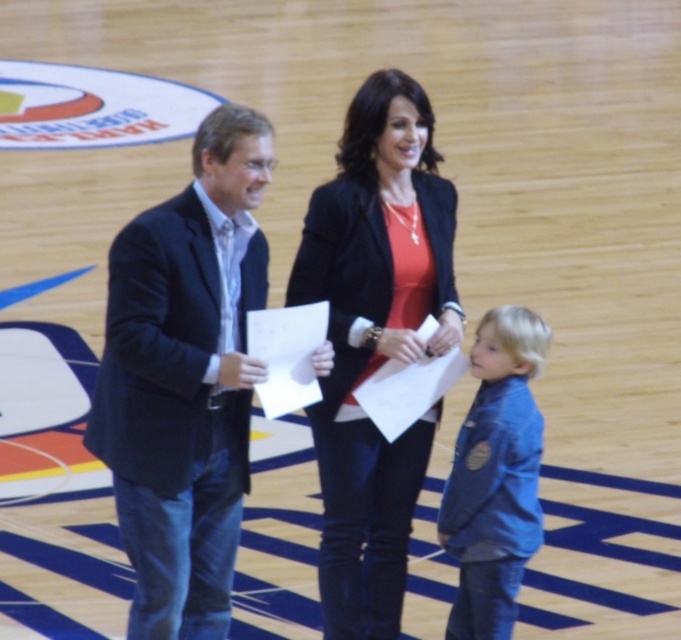
You are standing on the basketball court and want to place a new basketball hoop. The hoop must be placed at the same horizontal level as the matte black blazer at center. Where should you place the hoop horizontally?

The hoop should be placed horizontally at the same x coordinate as the matte black blazer at center, which is 0.533 on the horizontal axis.

You are standing at the point labeled point (347,512) and want to walk to the exit located behind the point labeled point (407,444). Can you directly walk straight back from your current position to reach the exit without moving sideways?

Yes, because point (407,444) is behind point (347,512), so walking straight back from point (347,512) will lead directly to the exit behind point (407,444).

You are an event planner organizing a formal event and need to ensure that all attendees follow the dress code. You notice two guests wearing matte black attire. One is wearing a matte black suit at left and the other a matte black blazer at center. Which guest is violating the dress code if the requirement specifies that the attire must be at least as long as the other?

The matte black suit at left is violating the dress code because it is shorter than the matte black blazer at center, which meets the minimum length requirement.